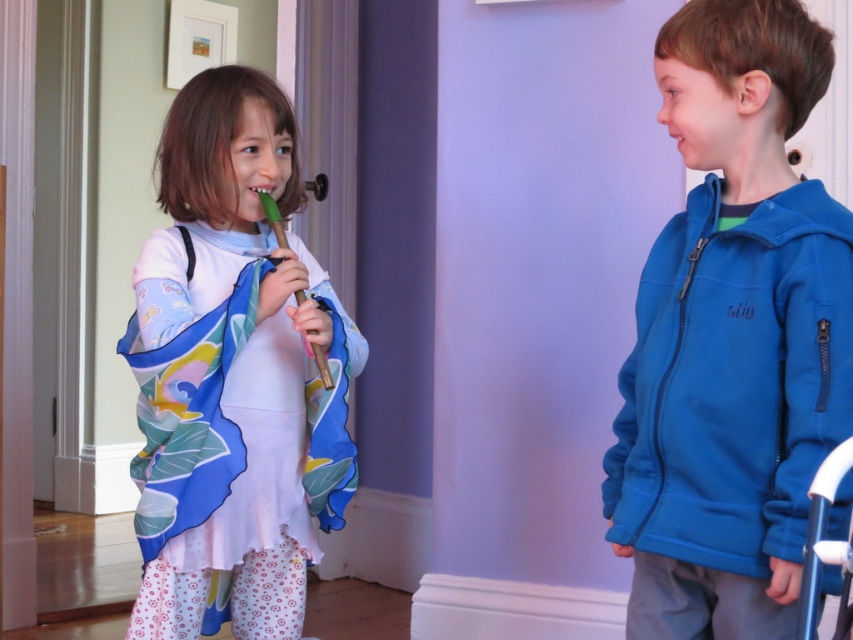
You are a parent standing in the living room where the children are playing. You want to hand the matte green flute at left to the child on the right. Can you reach it without moving from your current position?

The matte green flute at left is 1.70 meters away from the viewer. Since the parent is standing in the living room and the distance is within a typical reaching range, the parent can likely reach the matte green flute at left to hand it over.

You are a toy airplane that is 12 inches long. You want to fly from the blue fleece jacket at right to the pink matte mouth at upper center. Can you make the trip without touching either?

The distance between the blue fleece jacket at right and the pink matte mouth at upper center is 15.00 inches. Since the toy airplane is 12 inches long, it can make the trip without touching either as there is enough space.